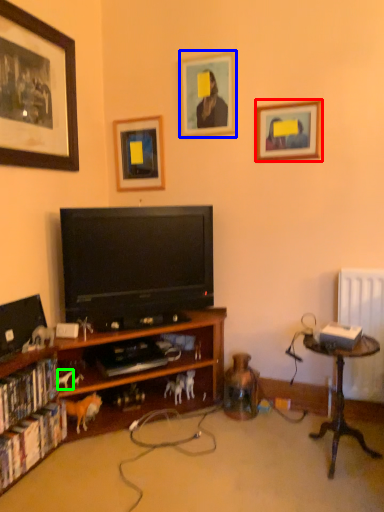
Question: Which object is the farthest from picture frame (highlighted by a red box)? Choose among these: picture frame (highlighted by a blue box) or animal (highlighted by a green box).

Choices:
 (A) picture frame
 (B) animal

Answer: (B)